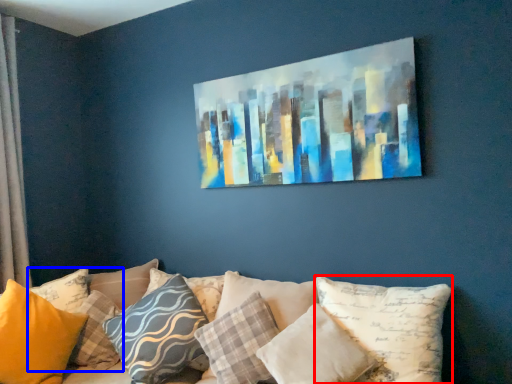
Question: Which point is closer to the camera, pillow (highlighted by a red box) or pillow (highlighted by a blue box)?

Choices:
 (A) pillow
 (B) pillow

Answer: (A)